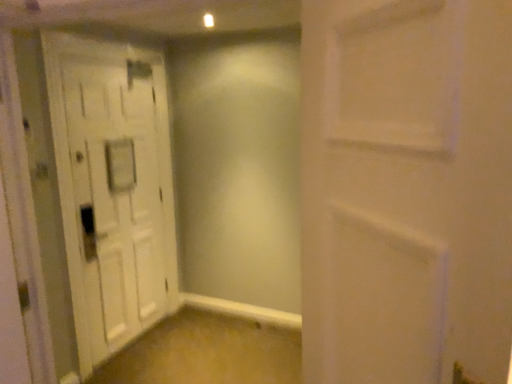
Question: Does white wooden door at left, the 2th door positioned from the right, appear on the right side of white matte door at center, acting as the second door starting from the left?

Choices:
 (A) yes
 (B) no

Answer: (B)

Question: From a real-world perspective, is white wooden door at left, placed as the first door when sorted from back to front, on top of white matte door at center, which ranks as the 1th door in right-to-left order?

Choices:
 (A) no
 (B) yes

Answer: (A)

Question: From the image's perspective, does white wooden door at left, the first door in the left-to-right sequence, appear lower than white matte door at center, the second door from the back?

Choices:
 (A) no
 (B) yes

Answer: (A)

Question: Considering the relative positions of white wooden door at left, the 2th door positioned from the right, and white matte door at center, acting as the second door starting from the left, in the image provided, is white wooden door at left, the 2th door positioned from the right, in front of white matte door at center, acting as the second door starting from the left,?

Choices:
 (A) yes
 (B) no

Answer: (B)

Question: From the image's perspective, would you say white wooden door at left, the 2th door positioned from the right, is positioned over white matte door at center, which is the first door from front to back?

Choices:
 (A) no
 (B) yes

Answer: (B)

Question: Would you say white wooden door at left, the 2th door positioned from the right, contains white matte door at center, which is the first door from front to back?

Choices:
 (A) no
 (B) yes

Answer: (A)

Question: Does white matte door at center, which ranks as the 1th door in right-to-left order, have a greater width compared to white wooden door at left, placed as the first door when sorted from back to front?

Choices:
 (A) yes
 (B) no

Answer: (B)

Question: From the image's perspective, would you say white matte door at center, the second door from the back, is shown under white wooden door at left, the 2th door positioned from the right?

Choices:
 (A) no
 (B) yes

Answer: (B)

Question: Considering the relative sizes of white matte door at center, which ranks as the 1th door in right-to-left order, and white wooden door at left, placed as the first door when sorted from back to front, in the image provided, is white matte door at center, which ranks as the 1th door in right-to-left order, smaller than white wooden door at left, placed as the first door when sorted from back to front,?

Choices:
 (A) yes
 (B) no

Answer: (A)

Question: Does white matte door at center, the second door from the back, have a lesser width compared to white wooden door at left, the first door in the left-to-right sequence?

Choices:
 (A) yes
 (B) no

Answer: (A)

Question: Is white matte door at center, which ranks as the 1th door in right-to-left order, facing towards white wooden door at left, the 2th door positioned from the right?

Choices:
 (A) no
 (B) yes

Answer: (A)

Question: Is white matte door at center, the second door from the back, completely or partially outside of white wooden door at left, the first door in the left-to-right sequence?

Choices:
 (A) no
 (B) yes

Answer: (B)

Question: From the image's perspective, is white matte door at center, the second door from the back, located above or below white wooden door at left, the first door in the left-to-right sequence?

Choices:
 (A) above
 (B) below

Answer: (B)